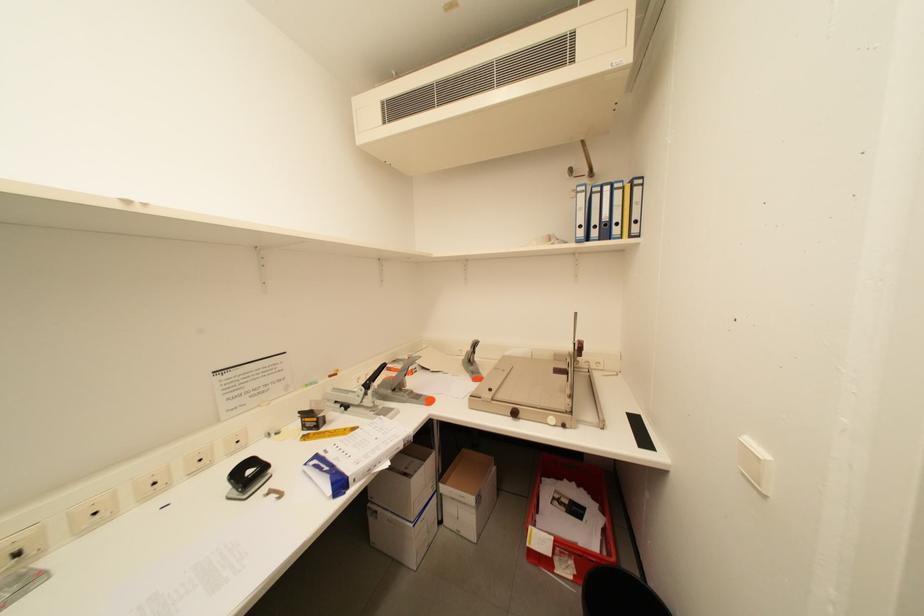
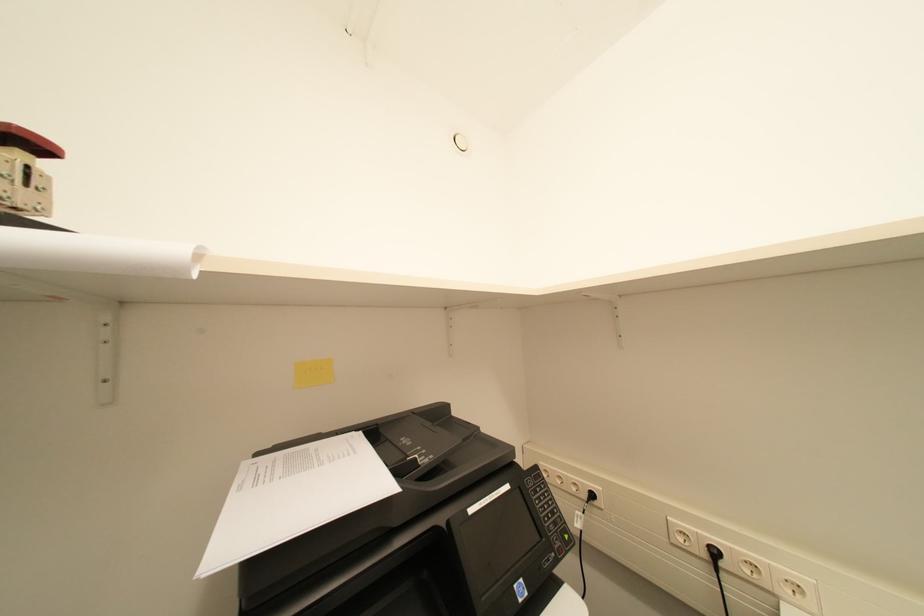
Question: The first image is from the beginning of the video and the second image is from the end. How did the camera likely rotate when shooting the video?

Choices:
 (A) Left
 (B) Right
 (C) Up
 (D) Down

Answer: (A)